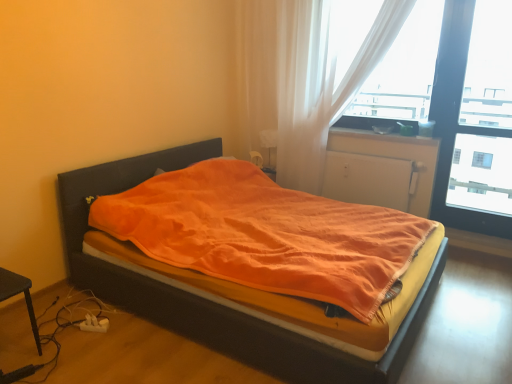
Image resolution: width=512 pixels, height=384 pixels. Identify the location of vacant region above white matte radiator at center (from a real-world perspective). (364, 152).